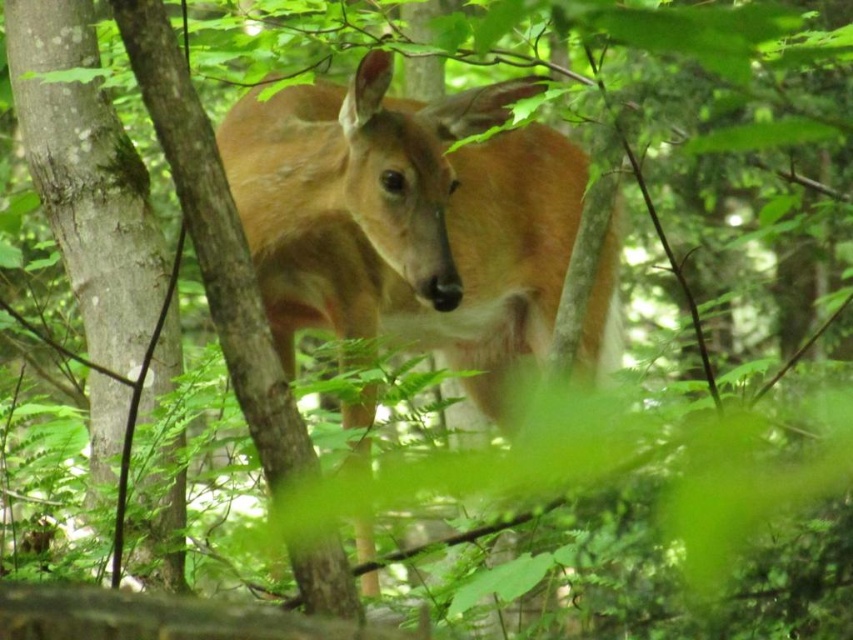
In the scene shown: You are an archer aiming to shoot an arrow at the brown velvet deer at center. The target is placed at point 0.5, 0.5. Will your arrow hit the deer if you aim directly at the deer?

The brown velvet deer at center is located at point (407,220), which is not at the target point (426,320). Therefore, aiming directly at the deer will not hit the target placed at (426,320).

You are a forest ranger observing the scene. You need to determine the relative position of the brown velvet deer at center and the smooth bark tree at center. Which object is located to the left of the other?

The brown velvet deer at center is positioned on the right side of smooth bark tree at center, so the smooth bark tree at center is to the left of the brown velvet deer at center.

You are standing in a forest and see a deer. You want to take a photo of the deer. You are at the point where the image was taken. The deer is at the point labeled point (291,132). Your camera has a focal length of 50mm and a sensor size of 24mm x 36mm. To ensure the deer fills the frame vertically, what is the minimum distance you need to be from the deer?

The point labeled point (291,132) is 7.14 feet away from the viewer. To calculate the minimum distance needed for the deer to fill the frame vertically, use the formula distance required equals sensor height divided by 2 times tangent of half the field of view. The sensor height is 24mm, and the field of view for a 50mm lens on a full frame sensor is approximately 27 degrees. Calculating, 24 divided by 2 times tan 13.5 degrees equals approximately 24 divided by 2 times 0.239 equals about 2.87 mm. Conver